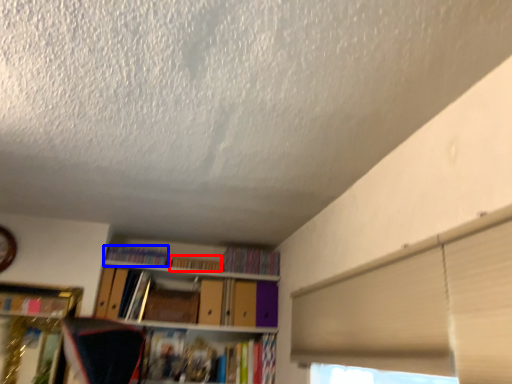
Question: Among these objects, which one is nearest to the camera, book (highlighted by a red box) or book (highlighted by a blue box)?

Choices:
 (A) book
 (B) book

Answer: (B)